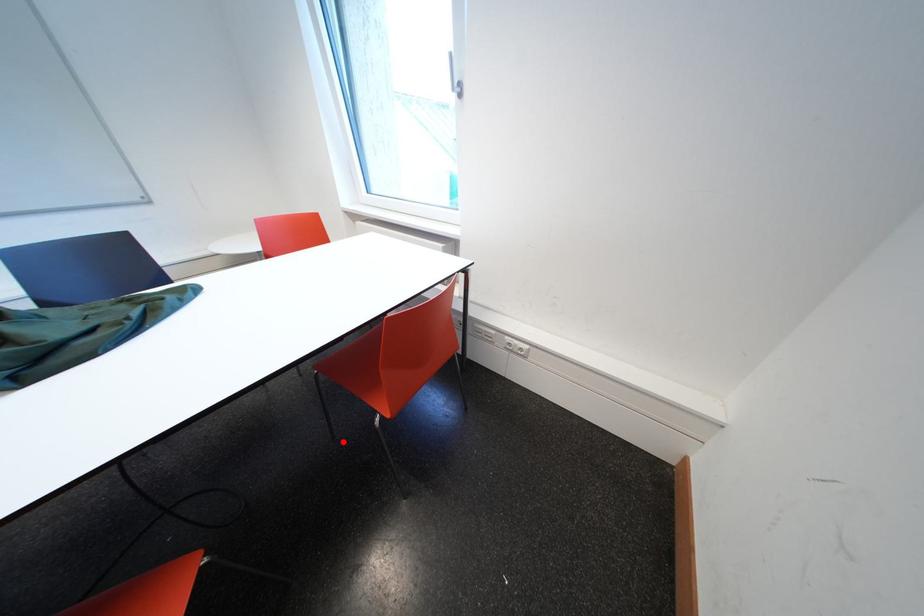
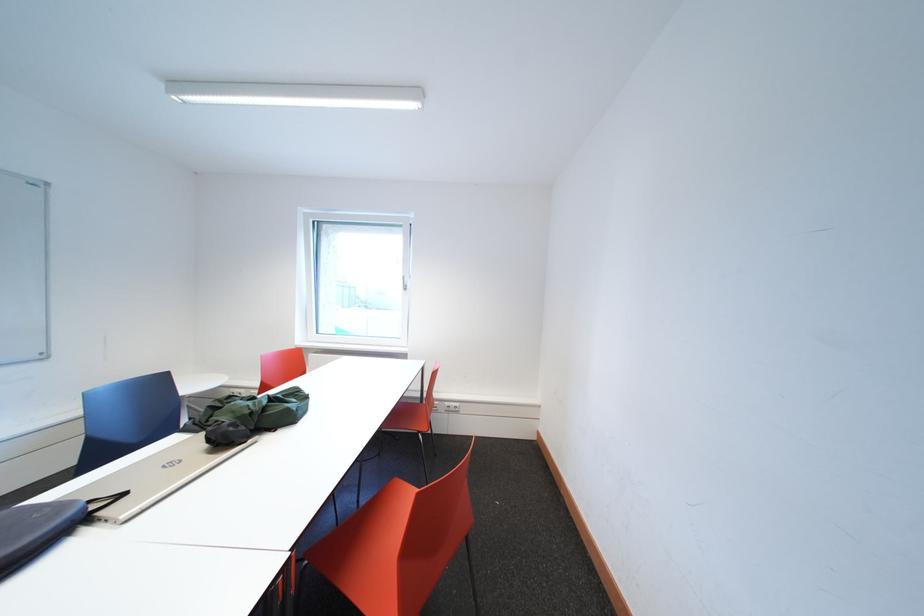
Question: I am providing you with two images of the same scene from different viewpoints. A red point is marked on the first image. Is the red point's position out of view in image 2?

Choices:
 (A) Yes
 (B) No

Answer: (B)